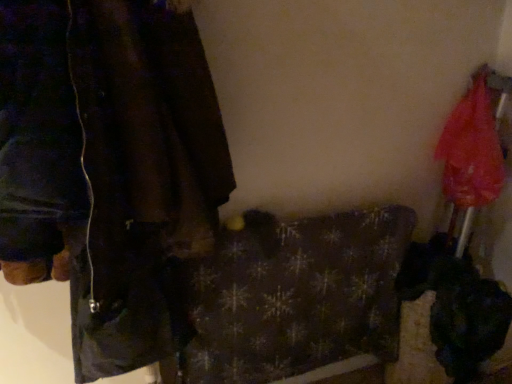
Question: Do you think dark brown leather jacket at left is within translucent nylon umbrella at right, or outside of it?

Choices:
 (A) outside
 (B) inside

Answer: (A)

Question: Is point (165, 175) closer or farther from the camera than point (463, 178)?

Choices:
 (A) closer
 (B) farther

Answer: (A)

Question: Estimate the real-world distances between objects in this image. Which object is closer to the dark brown leather jacket at left?

Choices:
 (A) dark plaid blanket at center
 (B) translucent nylon umbrella at right

Answer: (A)

Question: Estimate the real-world distances between objects in this image. Which object is closer to the dark plaid blanket at center?

Choices:
 (A) dark brown leather jacket at left
 (B) translucent nylon umbrella at right

Answer: (A)